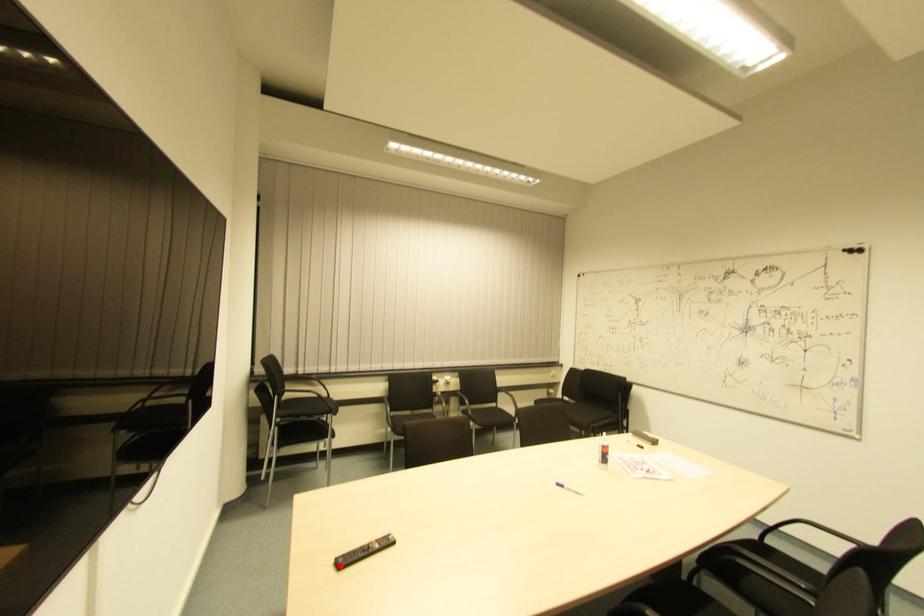
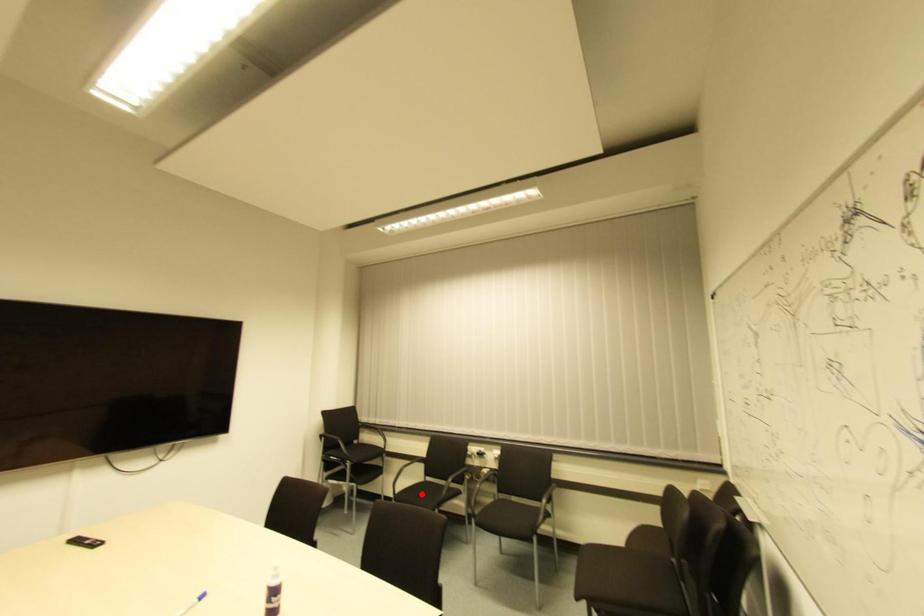
I am providing you with two images of the same scene from different viewpoints. A red point is marked on the first image and another point is marked on the second image. Is the marked point in image1 the same physical position as the marked point in image2?

No